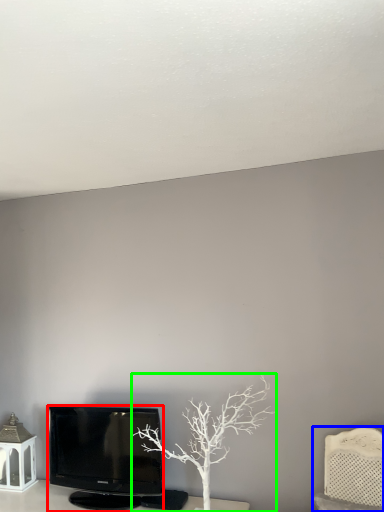
Question: Which object is the farthest from television (highlighted by a red box)? Choose among these: furniture (highlighted by a blue box) or tree (highlighted by a green box).

Choices:
 (A) furniture
 (B) tree

Answer: (A)